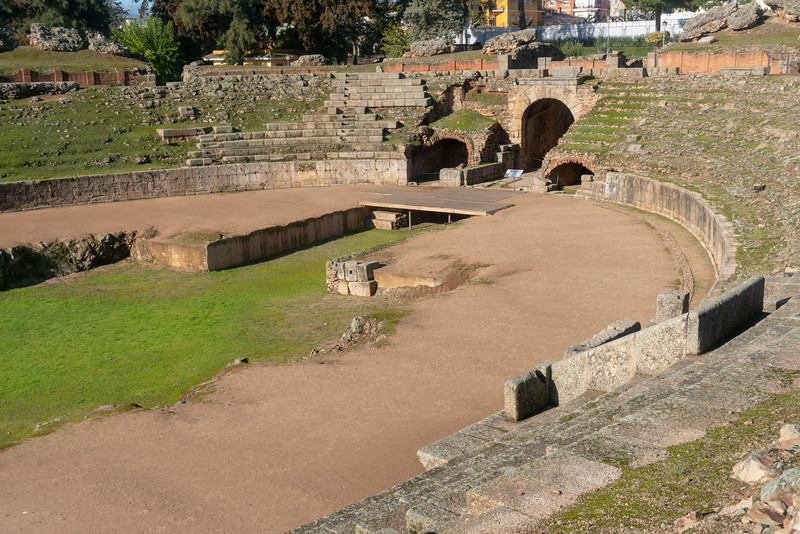
Identify the location of stacked objects on left wall in covered area in the center. The image size is (800, 534). (401, 216).